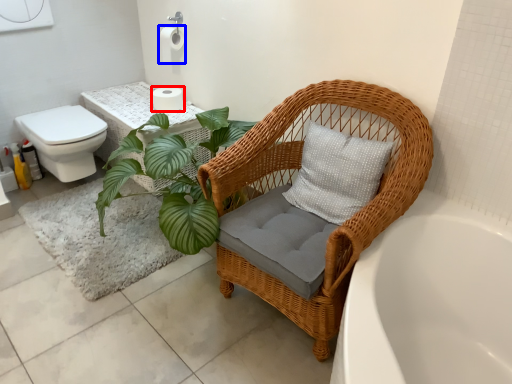
Question: Which of the following is the closest to the observer, toilet paper (highlighted by a red box) or toilet paper (highlighted by a blue box)?

Choices:
 (A) toilet paper
 (B) toilet paper

Answer: (B)